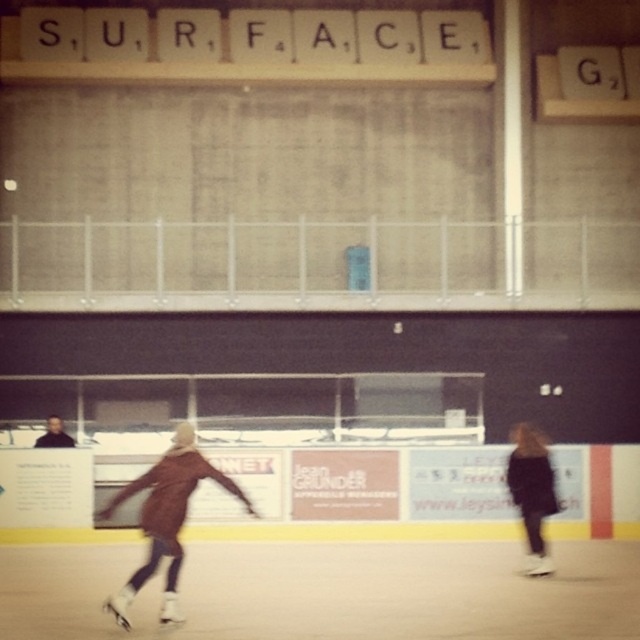
In the scene shown: Is brown matte jacket at lower left wider than dark brown leather jacket at lower right?

Indeed, brown matte jacket at lower left has a greater width compared to dark brown leather jacket at lower right.

Image resolution: width=640 pixels, height=640 pixels. I want to click on brown matte jacket at lower left, so click(x=164, y=516).